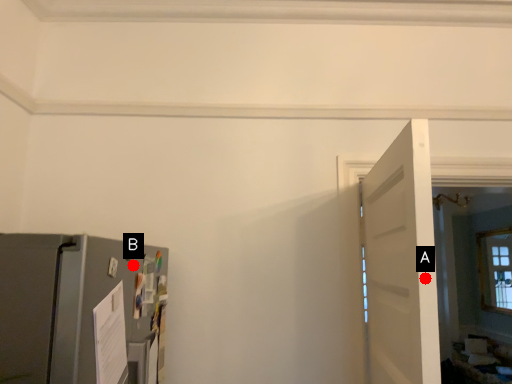
Question: Two points are circled on the image, labeled by A and B beside each circle. Which point is closer to the camera?

Choices:
 (A) A is closer
 (B) B is closer

Answer: (A)